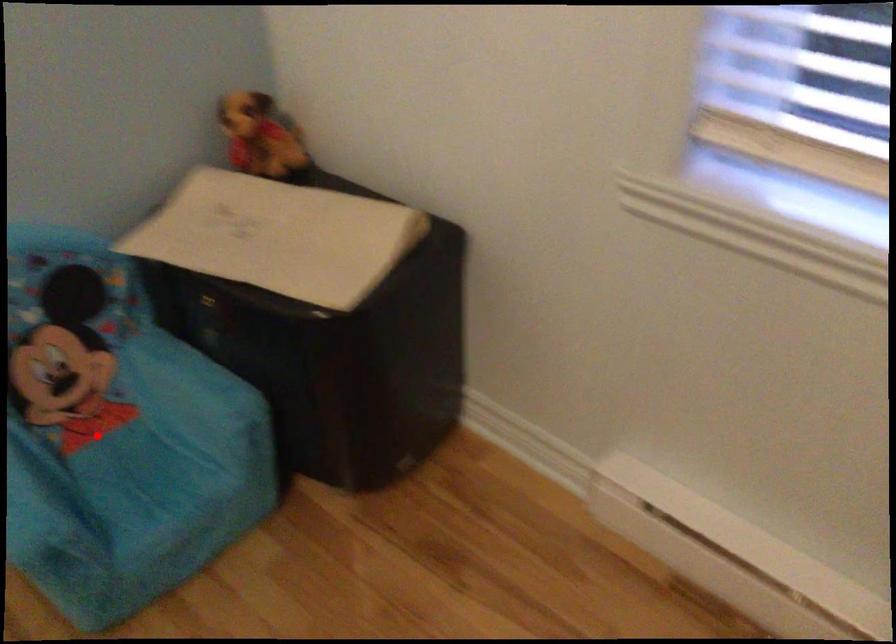
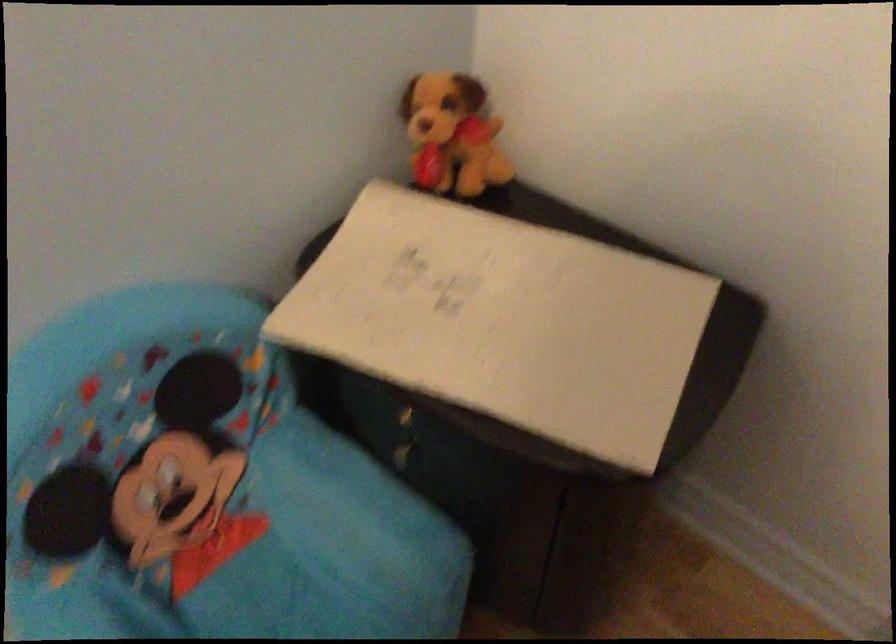
Question: I am providing you with two images of the same scene from different viewpoints. In image1, a red point is highlighted. Considering the same 3D point in image2, which of the following is correct?

Choices:
 (A) It is closer
 (B) It is farther

Answer: (A)